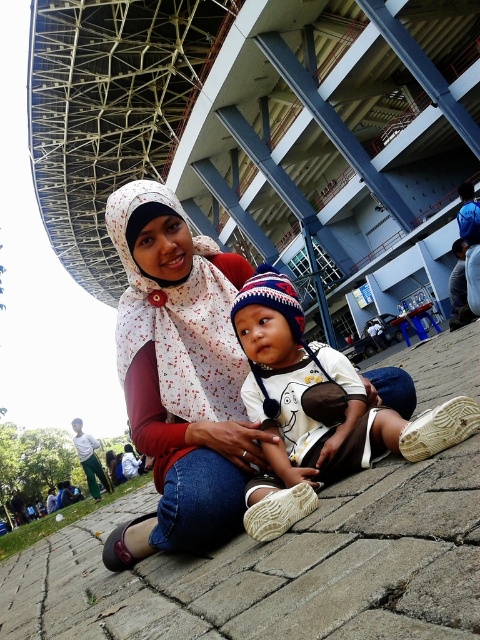
Question: Is the position of brick pavement at center less distant than that of white matte baby at center?

Choices:
 (A) no
 (B) yes

Answer: (B)

Question: Is brick pavement at center behind white matte baby at center?

Choices:
 (A) no
 (B) yes

Answer: (A)

Question: Is brick pavement at center further to the viewer compared to white matte baby at center?

Choices:
 (A) yes
 (B) no

Answer: (B)